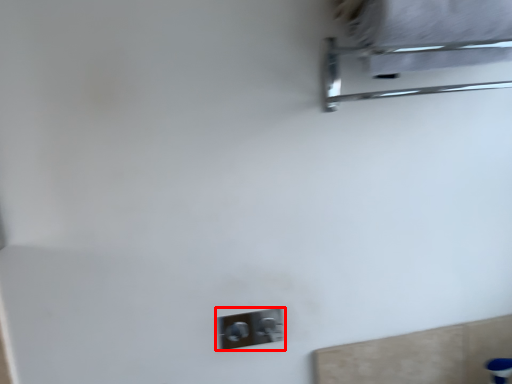
Question: From the image's perspective, where is light switch (annotated by the red box) located in relation to furniture in the image?

Choices:
 (A) above
 (B) below

Answer: (B)